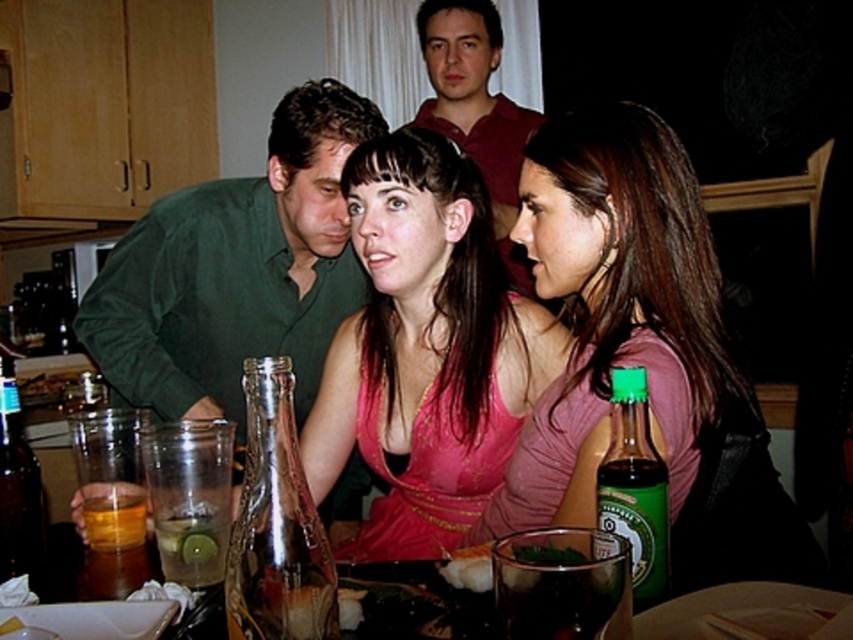
Question: Which object is the closest to the matte green shirt at upper center?

Choices:
 (A) amber liquid glass at lower left
 (B) clear glass bottle at center
 (C) translucent glass bottle at lower center
 (D) translucent glass bottle at lower left

Answer: (C)

Question: Is green matte shirt at left to the right of translucent glass bottle at lower center from the viewer's perspective?

Choices:
 (A) no
 (B) yes

Answer: (A)

Question: Observing the image, what is the correct spatial positioning of matte green shirt at upper center in reference to amber liquid glass at lower left?

Choices:
 (A) below
 (B) above

Answer: (B)

Question: Which object appears closest to the camera in this image?

Choices:
 (A) amber liquid glass at lower left
 (B) translucent glass bottle at lower left
 (C) pink fabric dress at center

Answer: (C)

Question: Is clear glass bottle at center below amber liquid glass at lower left?

Choices:
 (A) no
 (B) yes

Answer: (A)

Question: Among these points, which one is farthest from the camera?

Choices:
 (A) tap(619, 384)
 (B) tap(508, 148)

Answer: (B)